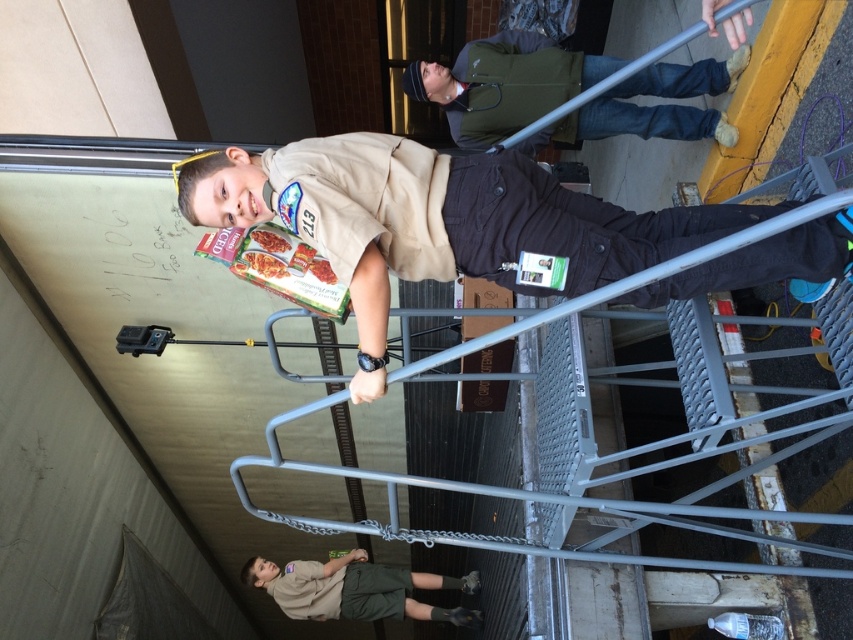
Based on the photo, between matte brown uniform at center and green fabric jacket at upper center, which one is positioned higher?

Positioned higher is green fabric jacket at upper center.

Is matte brown uniform at center to the right of green fabric jacket at upper center from the viewer's perspective?

Incorrect, matte brown uniform at center is not on the right side of green fabric jacket at upper center.

Is point (834, 269) more distant than point (604, 65)?

No, (834, 269) is closer to viewer.

Identify the location of matte brown uniform at center. (437, 220).

Is matte brown uniform at center thinner than khaki uniform at center?

Incorrect, matte brown uniform at center's width is not less than khaki uniform at center's.

Does matte brown uniform at center appear on the left side of khaki uniform at center?

Incorrect, matte brown uniform at center is not on the left side of khaki uniform at center.

Where is `matte brown uniform at center`? The image size is (853, 640). matte brown uniform at center is located at coordinates (437, 220).

Does green fabric jacket at upper center have a smaller size compared to khaki uniform at center?

Actually, green fabric jacket at upper center might be larger than khaki uniform at center.

Who is more distant from viewer, (459, 97) or (405, 596)?

Positioned behind is point (405, 596).

Which is behind, point (506, 104) or point (442, 616)?

The point (442, 616) is behind.

The width and height of the screenshot is (853, 640). I want to click on green fabric jacket at upper center, so click(x=503, y=83).